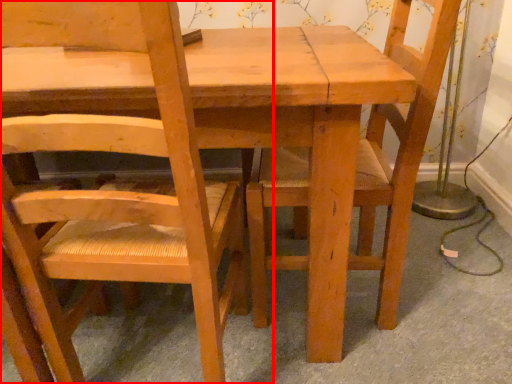
Question: From the image's perspective, what is the correct spatial relationship of chair (annotated by the red box) in relation to chair?

Choices:
 (A) above
 (B) below

Answer: (B)